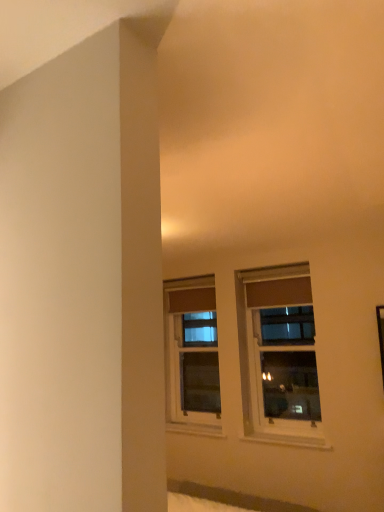
Question: Considering the positions of point (284, 385) and point (215, 322), is point (284, 385) closer or farther from the camera than point (215, 322)?

Choices:
 (A) farther
 (B) closer

Answer: (B)

Question: Is clear glass window at center, which appears as the second window when viewed from the back, inside the boundaries of matte brown window at center, which is the 2th window from right to left, or outside?

Choices:
 (A) outside
 (B) inside

Answer: (A)

Question: Would you say clear glass window at center, arranged as the first window when viewed from the front, is to the left or to the right of matte brown window at center, which is the first window from back to front, in the picture?

Choices:
 (A) right
 (B) left

Answer: (A)

Question: Do you think matte brown window at center, which is the first window from back to front, is within clear glass window at center, placed as the first window when sorted from right to left, or outside of it?

Choices:
 (A) inside
 (B) outside

Answer: (B)

Question: Considering their positions, is matte brown window at center, the 2th window positioned from the front, located in front of or behind clear glass window at center, marked as the second window in a left-to-right arrangement?

Choices:
 (A) behind
 (B) front

Answer: (A)

Question: In terms of width, does matte brown window at center, which is the 2th window from right to left, look wider or thinner when compared to clear glass window at center, which appears as the second window when viewed from the back?

Choices:
 (A) wide
 (B) thin

Answer: (A)

Question: Is point (196, 326) closer or farther from the camera than point (301, 339)?

Choices:
 (A) farther
 (B) closer

Answer: (A)